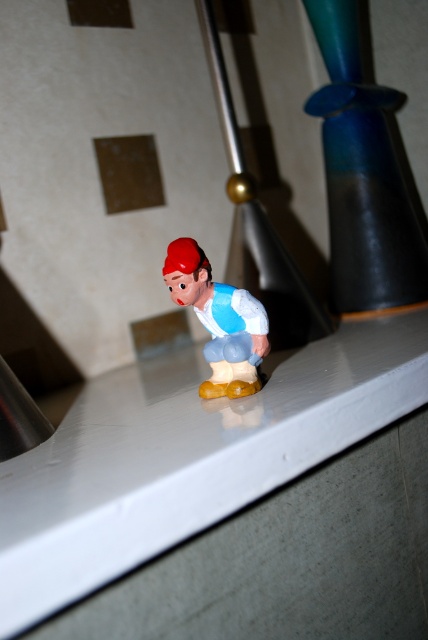
Question: Can you confirm if white glossy counter top at center is positioned above matte plastic toy at center?

Choices:
 (A) yes
 (B) no

Answer: (B)

Question: Is white glossy counter top at center further to the viewer compared to matte plastic toy at center?

Choices:
 (A) yes
 (B) no

Answer: (B)

Question: Which point appears closest to the camera in this image?

Choices:
 (A) (216, 301)
 (B) (0, 604)

Answer: (B)

Question: Is white glossy counter top at center below matte plastic toy at center?

Choices:
 (A) yes
 (B) no

Answer: (A)